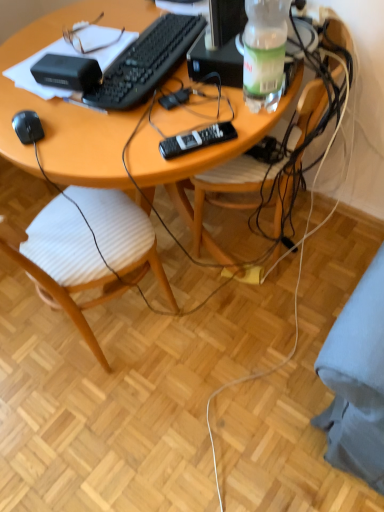
This screenshot has height=512, width=384. Find the location of `free space to the left of black plastic remote at center`. free space to the left of black plastic remote at center is located at coordinates (134, 144).